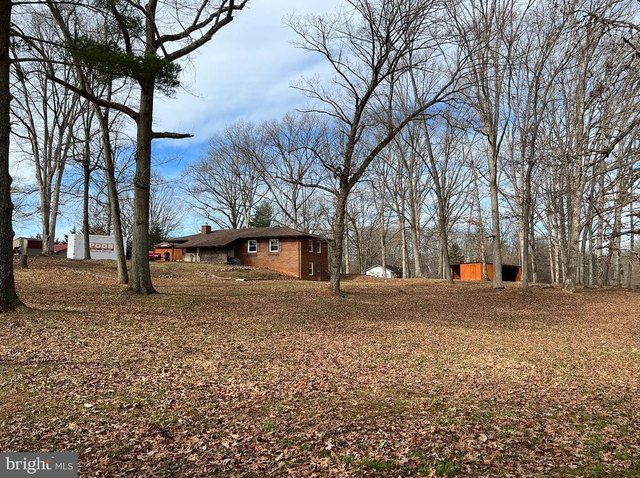
This screenshot has height=478, width=640. Identify the location of white storage container. (74, 242).